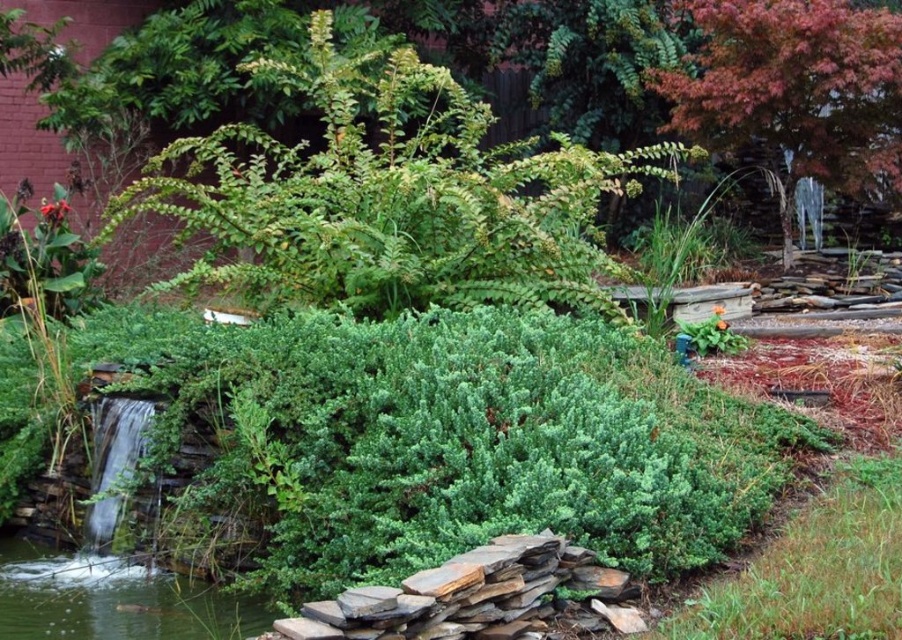
Question: Which point appears farthest from the camera in this image?

Choices:
 (A) (23, 589)
 (B) (527, 224)

Answer: (B)

Question: Which object appears closest to the camera in this image?

Choices:
 (A) reddish-brown textured tree at upper right
 (B) clear water at lower left
 (C) green leafy bush at upper center

Answer: (B)

Question: Does reddish-brown textured tree at upper right appear on the right side of clear water at lower left?

Choices:
 (A) yes
 (B) no

Answer: (A)

Question: Does reddish-brown textured tree at upper right appear under clear water at lower left?

Choices:
 (A) no
 (B) yes

Answer: (A)

Question: Which object is closer to the camera taking this photo?

Choices:
 (A) reddish-brown textured tree at upper right
 (B) clear water at lower left

Answer: (B)

Question: Is reddish-brown textured tree at upper right thinner than clear water at lower left?

Choices:
 (A) yes
 (B) no

Answer: (B)